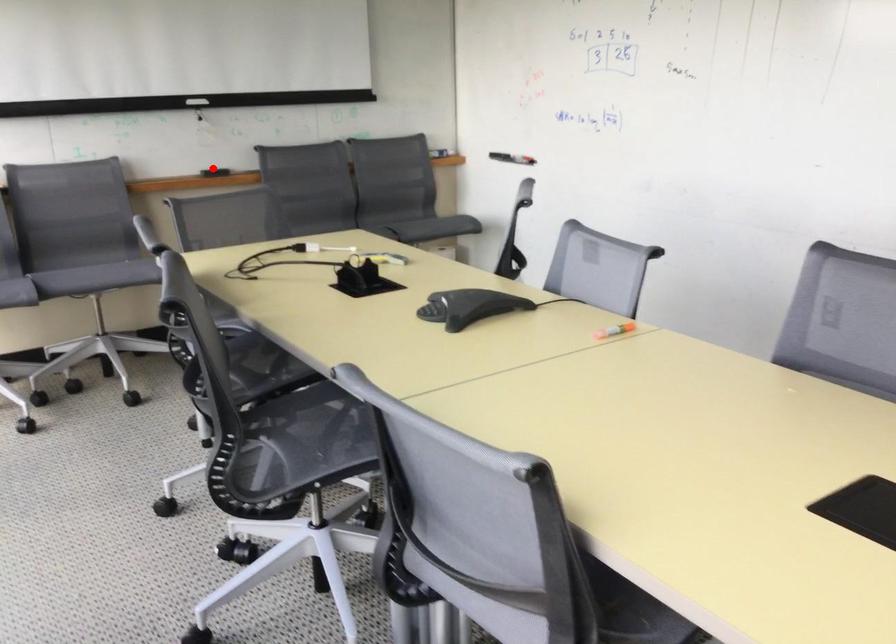
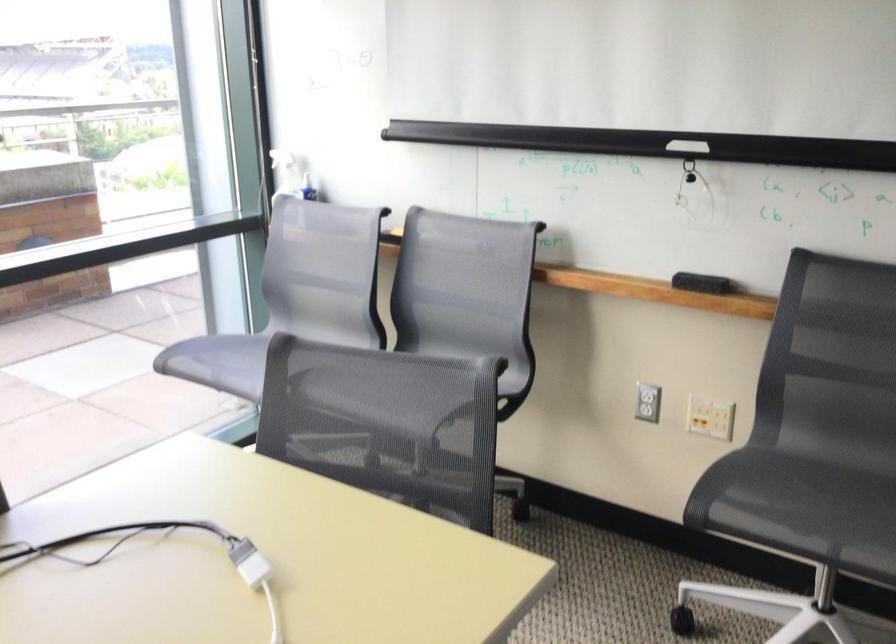
Question: I am providing you with two images of the same scene from different viewpoints. Given a red point in image1, look at the same physical point in image2. Is it:

Choices:
 (A) Closer to the viewpoint
 (B) Farther from the viewpoint

Answer: (A)